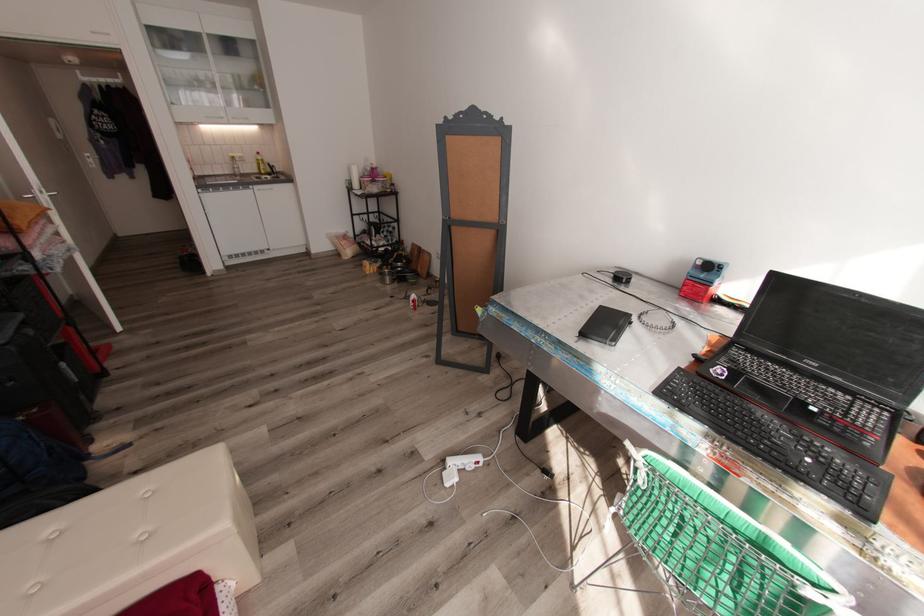
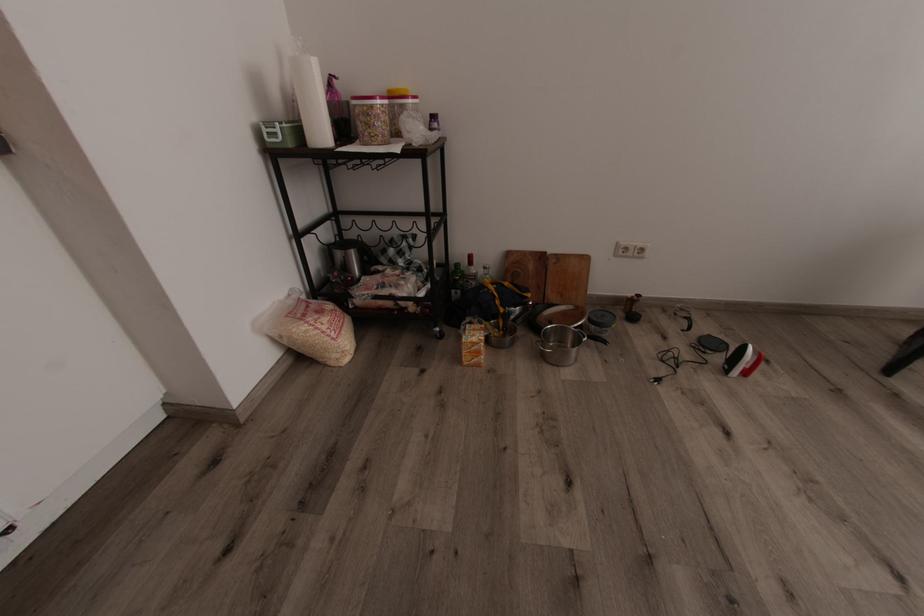
The point at [369,183] is marked in the first image. Where is the corresponding point in the second image?

(382, 116)